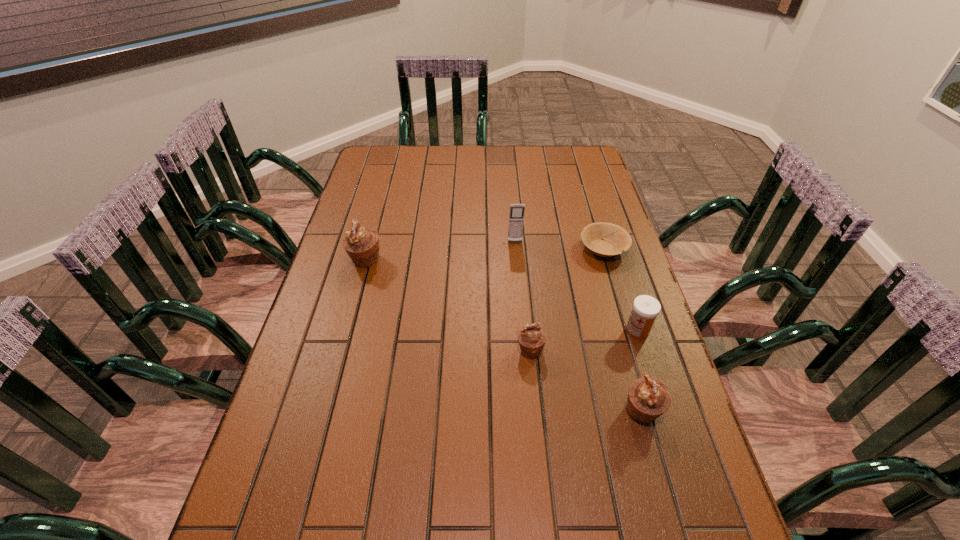
Locate an element on the screen. Image resolution: width=960 pixels, height=540 pixels. empty location between the leftmost muffin and the third tallest object is located at coordinates (504, 336).

This screenshot has width=960, height=540. I want to click on free space that is in between the farthest muffin and the fourth shortest object, so click(x=504, y=336).

The image size is (960, 540). What are the coordinates of `free space between the farthest muffin and the medicine` in the screenshot? It's located at (501, 295).

At what (x,y) coordinates should I click in order to perform the action: click on the fifth closest object to the leftmost object. Please return your answer as a coordinate pair (x, y). Looking at the image, I should click on (648, 398).

Locate which object ranks fifth in proximity to the cellular telephone. Please provide its 2D coordinates. Your answer should be formatted as a tuple, i.e. [(x, y)], where the tuple contains the x and y coordinates of a point satisfying the conditions above.

[(648, 398)]

Locate an element on the screen. The image size is (960, 540). muffin that stands as the closest to the cellular telephone is located at coordinates (531, 338).

Locate an element on the screen. This screenshot has height=540, width=960. muffin identified as the second closest to the bowl is located at coordinates (648, 398).

Where is `blank area in the image that satisfies the following two spatial constraints: 1. on the back side of the medicine; 2. on the right side of the second nearest muffin`? This screenshot has height=540, width=960. blank area in the image that satisfies the following two spatial constraints: 1. on the back side of the medicine; 2. on the right side of the second nearest muffin is located at coordinates (528, 330).

What are the coordinates of `free space that satisfies the following two spatial constraints: 1. on the front side of the second muffin from left to right; 2. on the right side of the nearest object` in the screenshot? It's located at (537, 411).

This screenshot has width=960, height=540. I want to click on vacant point that satisfies the following two spatial constraints: 1. on the front-facing side of the bowl; 2. on the left side of the cellular telephone, so click(x=516, y=248).